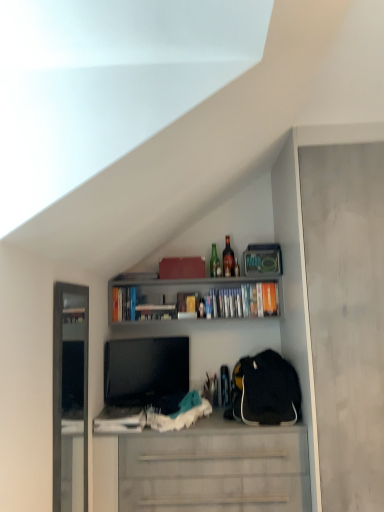
I want to click on free space above hardcover books at upper center, arranged as the third book when viewed from the left (from a real-world perspective), so click(196, 276).